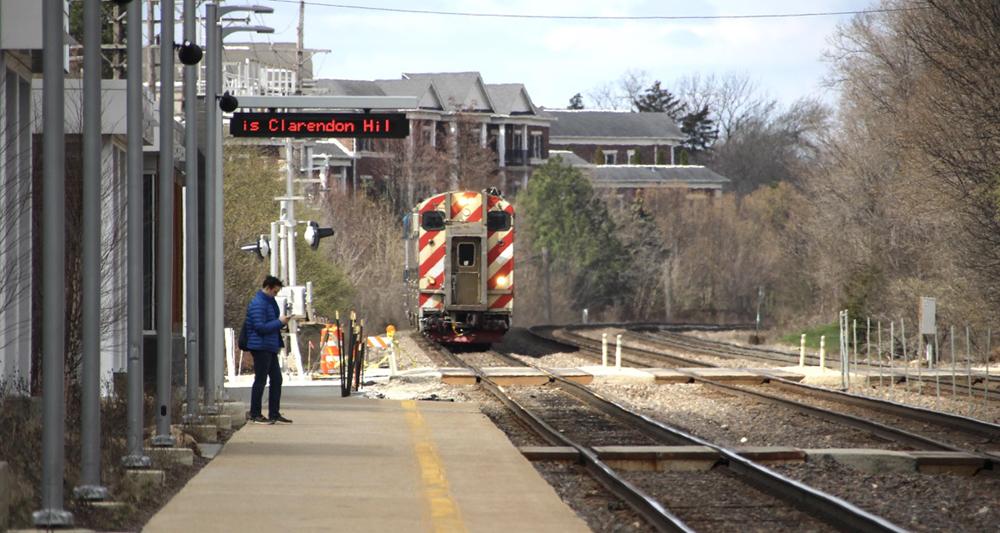
At what (x,y) coordinates should I click in order to perform the action: click on window. Please return your answer as a coordinate pair (x, y). The width and height of the screenshot is (1000, 533). Looking at the image, I should click on (432, 218), (498, 220), (468, 254).